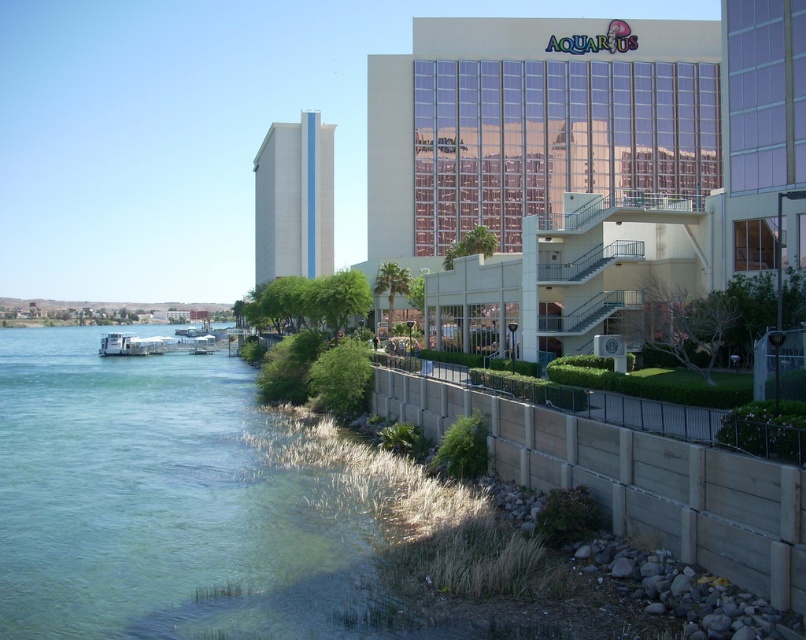
Question: Which object is the closest to the white matte boat at lower left?

Choices:
 (A) white smooth tower at center
 (B) clear water at lower left

Answer: (B)

Question: Which object is farther from the camera taking this photo?

Choices:
 (A) white smooth tower at center
 (B) clear water at lower left
 (C) glassy reflective building at upper center

Answer: (A)

Question: Does glassy reflective building at upper center appear under white matte boat at lower left?

Choices:
 (A) yes
 (B) no

Answer: (B)

Question: Which of the following is the farthest from the observer?

Choices:
 (A) (514, 22)
 (B) (48, 557)

Answer: (A)

Question: Can you confirm if clear water at lower left is positioned to the right of white smooth tower at center?

Choices:
 (A) no
 (B) yes

Answer: (B)

Question: Is glassy reflective building at upper center behind white smooth tower at center?

Choices:
 (A) no
 (B) yes

Answer: (A)